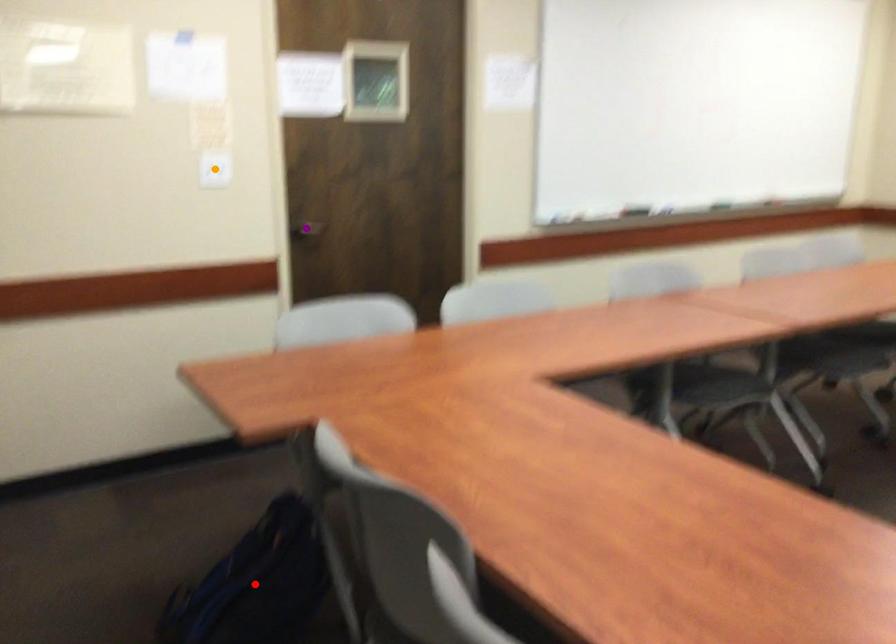
Order these from nearest to farthest:
purple point, red point, orange point

red point < orange point < purple point